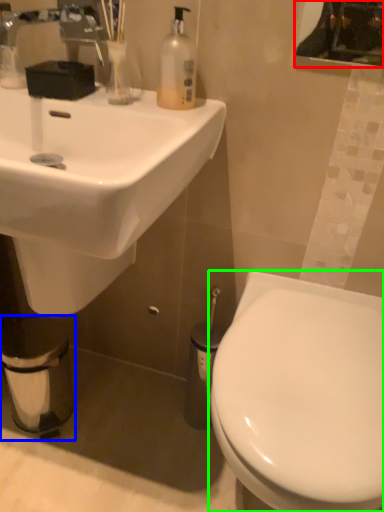
Question: Considering the real-world distances, which object is farthest from mirror (highlighted by a red box)? toilet paper (highlighted by a blue box) or toilet (highlighted by a green box)?

Choices:
 (A) toilet paper
 (B) toilet

Answer: (A)